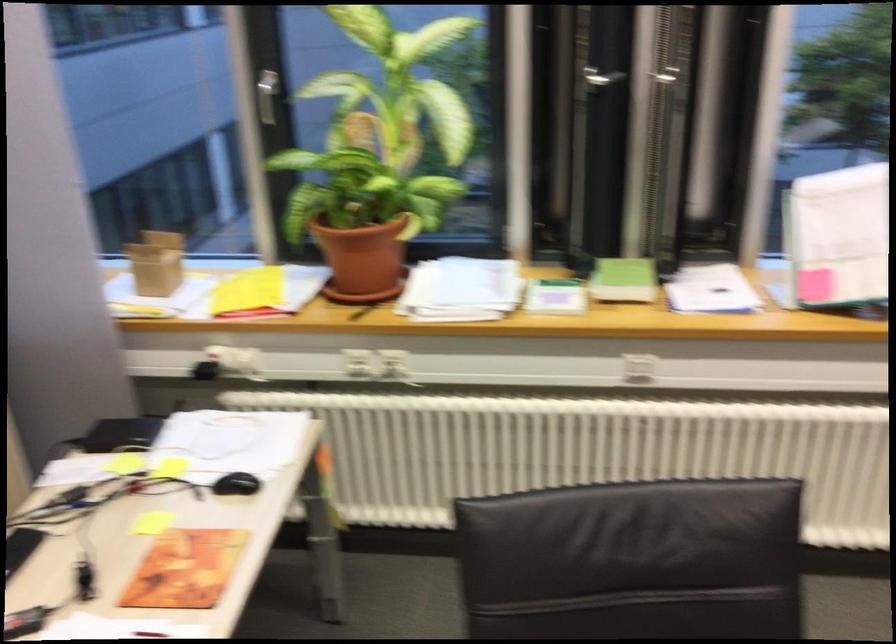
The width and height of the screenshot is (896, 644). I want to click on orange book, so click(x=185, y=569).